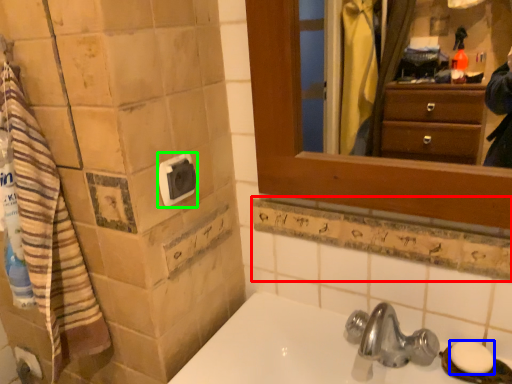
Question: Based on their relative distances, which object is nearer to ledge (highlighted by a red box)? Choose from soap (highlighted by a blue box) and towel bar (highlighted by a green box).

Choices:
 (A) soap
 (B) towel bar

Answer: (A)